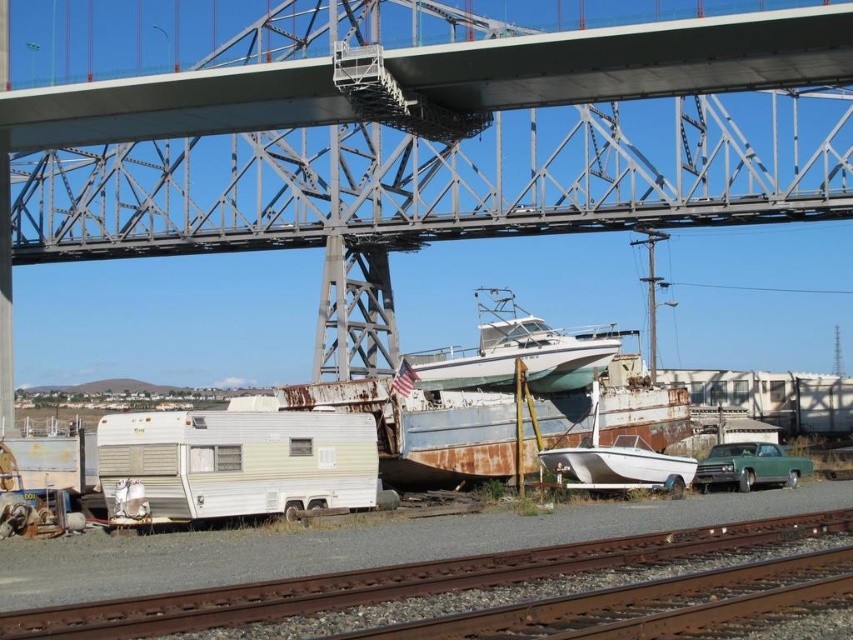
You are a delivery driver who needs to transport a 3.5 meter tall container through the area. Based on the scene, can the container pass under the metallic gray bridge at upper center without hitting the rusty metal train track at lower center?

The metallic gray bridge at upper center is above the rusty metal train track at lower center, so the container can pass under the bridge as long as it stays within the path between them. However, the train track is at lower center, so the driver must ensure the container does not collide with it while navigating under the bridge.

Looking at this image, you are a photographer planning to capture the metallic gray bridge at upper center and the green matte car at lower right in a single frame. Based on their sizes, which object should you focus on to ensure both are clearly visible without zooming in or out?

The metallic gray bridge at upper center is wider than the green matte car at lower right, so focusing on the bridge will help keep both objects in clear view without adjusting the zoom.

In the scene shown: You are a delivery drone with a maximum flight height of 50 meters. You need to fly from the metallic gray bridge at upper center to the rusty metal train track at lower center. Can you safely pass between them without exceeding your height limit?

The distance between the metallic gray bridge at upper center and the rusty metal train track at lower center is 52.29 meters. Since the drone has a maximum flight height of 50 meters, it cannot safely pass between them without exceeding its height limit.